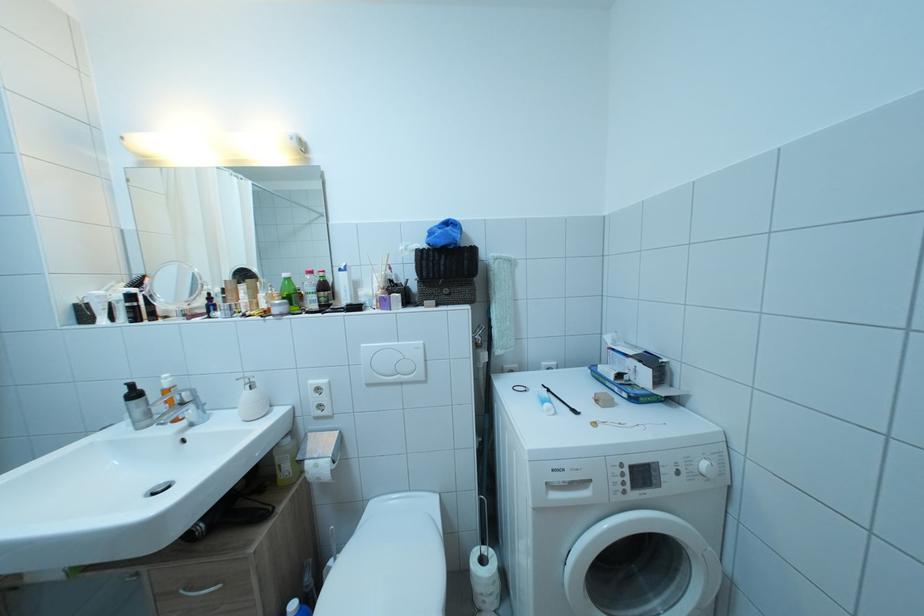
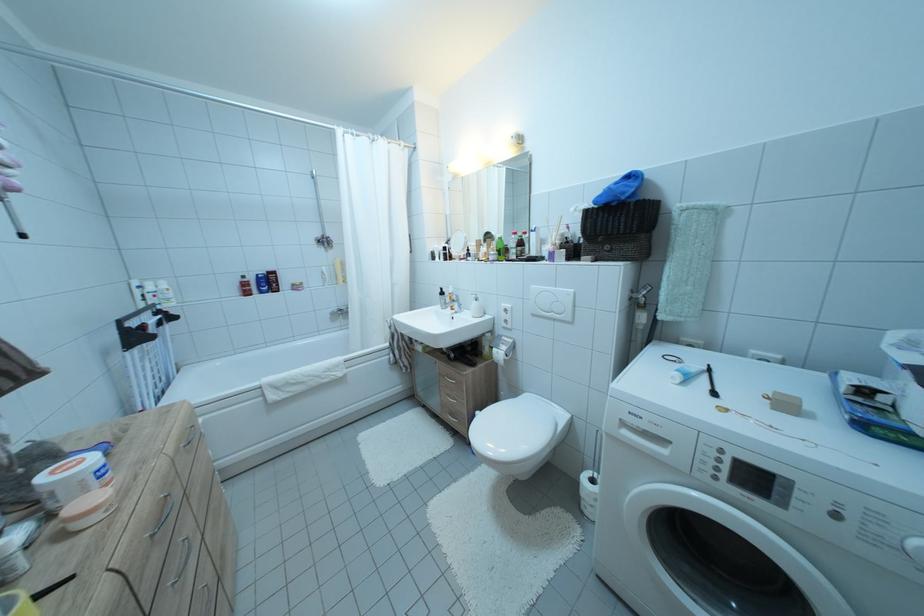
Question: How did the camera likely rotate?

Choices:
 (A) Left
 (B) Right
 (C) Up
 (D) Down

Answer: (A)